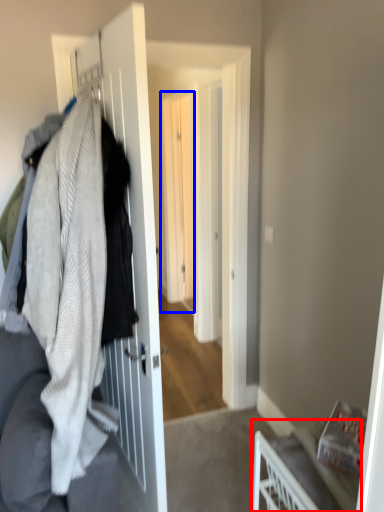
Question: Which point is further to the camera, furniture (highlighted by a red box) or screen door (highlighted by a blue box)?

Choices:
 (A) furniture
 (B) screen door

Answer: (B)